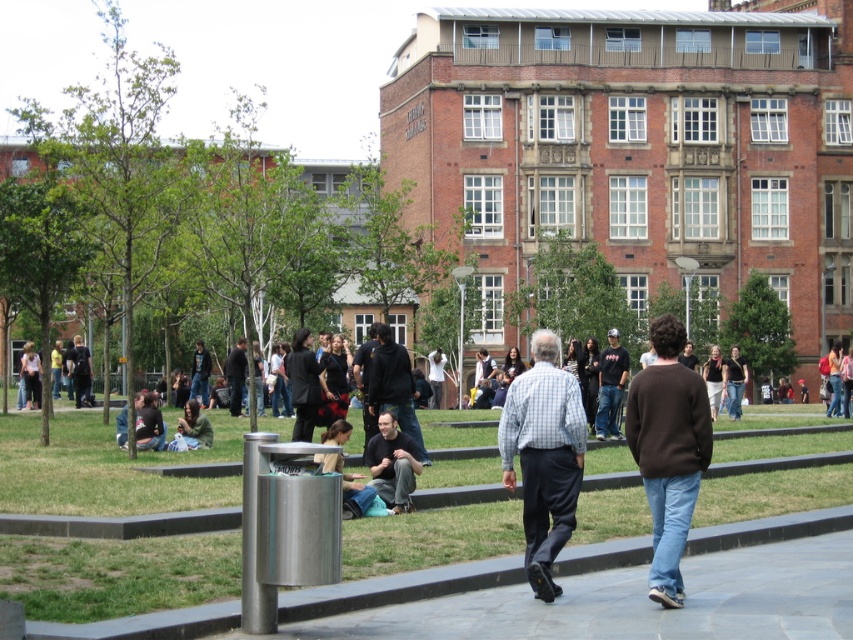
Question: Can you confirm if brown sweater at center is wider than light blue checkered shirt at center?

Choices:
 (A) no
 (B) yes

Answer: (A)

Question: Which of the following is the closest to the observer?

Choices:
 (A) (514, 490)
 (B) (234, 376)

Answer: (A)

Question: Which point is closer to the camera taking this photo?

Choices:
 (A) (398, 496)
 (B) (33, 436)
 (C) (604, 369)

Answer: (A)

Question: Does black t-shirt at center have a greater width compared to dark blue shirt at center?

Choices:
 (A) yes
 (B) no

Answer: (B)

Question: Which object is closer to the camera taking this photo?

Choices:
 (A) black t-shirt at center
 (B) green grass at center

Answer: (B)

Question: Is dark gray jeans at center positioned before dark blue shirt at center?

Choices:
 (A) yes
 (B) no

Answer: (A)